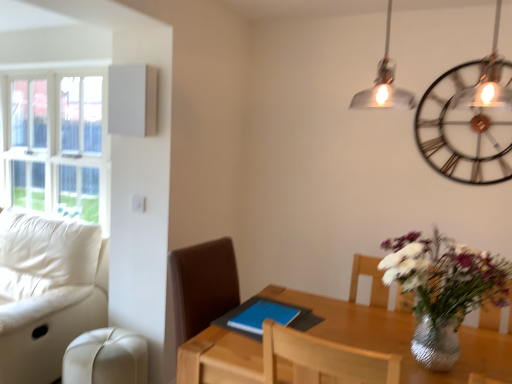
Question: Is white leather couch at left far from wooden table at center?

Choices:
 (A) no
 (B) yes

Answer: (B)

Question: From a real-world perspective, does white leather couch at left stand above wooden table at center?

Choices:
 (A) yes
 (B) no

Answer: (A)

Question: From a real-world perspective, is white leather couch at left below wooden table at center?

Choices:
 (A) yes
 (B) no

Answer: (B)

Question: Considering the relative sizes of white leather couch at left and wooden table at center in the image provided, is white leather couch at left taller than wooden table at center?

Choices:
 (A) no
 (B) yes

Answer: (B)

Question: Is wooden table at center located within white leather couch at left?

Choices:
 (A) yes
 (B) no

Answer: (B)

Question: Is metallic/textured wall clock at upper right taller or shorter than white glass window at upper left?

Choices:
 (A) tall
 (B) short

Answer: (B)

Question: Looking at their shapes, would you say metallic/textured wall clock at upper right is wider or thinner than white glass window at upper left?

Choices:
 (A) thin
 (B) wide

Answer: (A)

Question: Is metallic/textured wall clock at upper right spatially inside white glass window at upper left, or outside of it?

Choices:
 (A) outside
 (B) inside

Answer: (A)

Question: Based on their positions, is metallic/textured wall clock at upper right located to the left or right of white glass window at upper left?

Choices:
 (A) right
 (B) left

Answer: (A)

Question: Is point (253, 311) closer or farther from the camera than point (350, 314)?

Choices:
 (A) closer
 (B) farther

Answer: (A)

Question: From a real-world perspective, is blue matte tablet at center positioned above or below wooden table at center?

Choices:
 (A) below
 (B) above

Answer: (B)

Question: Looking at their shapes, would you say blue matte tablet at center is wider or thinner than wooden table at center?

Choices:
 (A) wide
 (B) thin

Answer: (B)

Question: Is blue matte tablet at center taller or shorter than wooden table at center?

Choices:
 (A) short
 (B) tall

Answer: (A)

Question: In terms of width, does blue matte tablet at center look wider or thinner when compared to white leather couch at left?

Choices:
 (A) thin
 (B) wide

Answer: (A)

Question: From the image's perspective, is blue matte tablet at center positioned above or below white leather couch at left?

Choices:
 (A) below
 (B) above

Answer: (B)